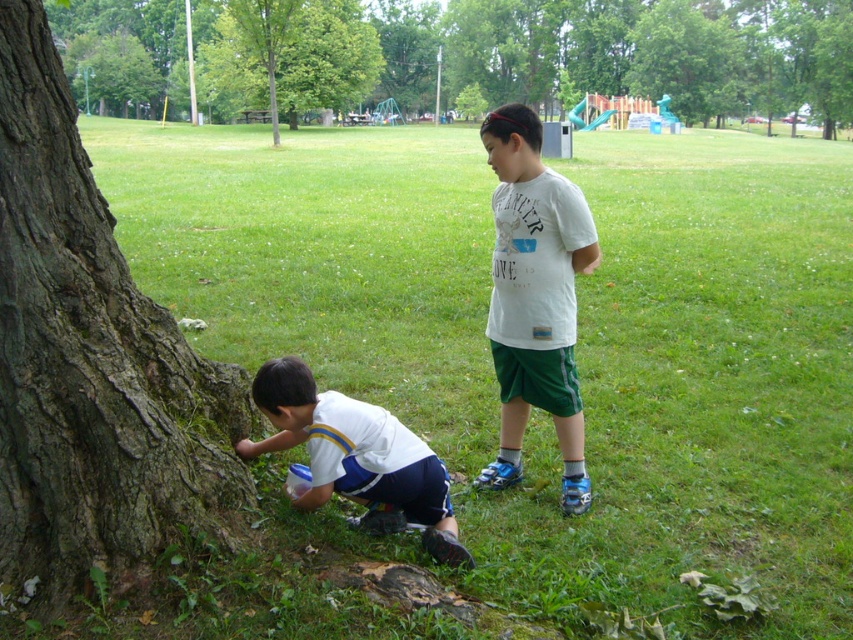
You are a parent trying to locate your child who is playing in the park. You see the green grass at lower left and the brown rough bark tree trunk at lower left. Which object is closer to you?

The green grass at lower left is closer to you because it is further to the viewer than the brown rough bark tree trunk at lower left.

You are a gardener trying to plant a new flower bed. You have two areas to choose from in the park scene shown. One is the green grass at lower left and the other is the smooth bark tree at left. Which area has a narrower width for planting?

The green grass at lower left has a narrower width than the smooth bark tree at left, so it is the narrower area for planting.

You are a gardener who wants to mow the green grass at lower left and trim the brown rough bark tree trunk at lower left. Which one should you tackle first if you want to start with the taller object?

The green grass at lower left is taller than the brown rough bark tree trunk at lower left, so you should start by mowing the green grass at lower left first.